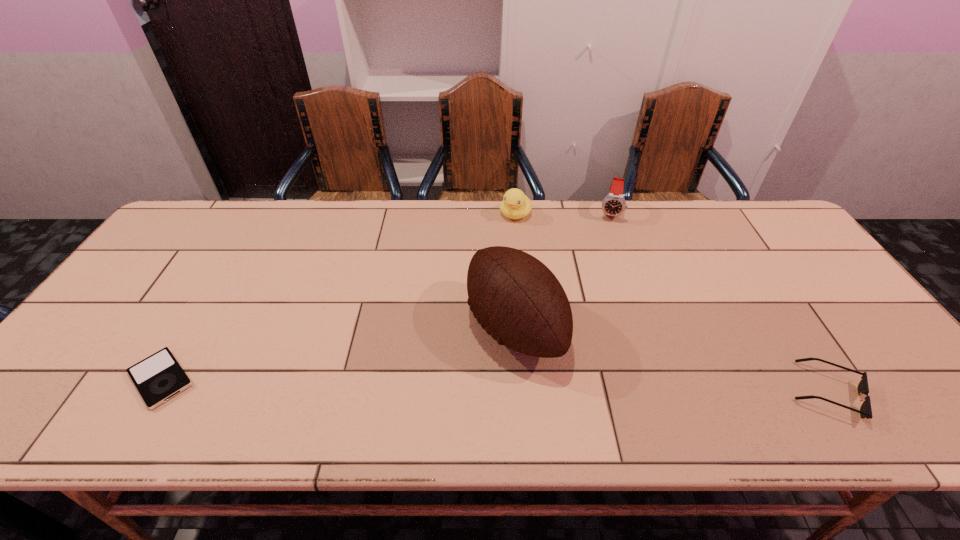
Image resolution: width=960 pixels, height=540 pixels. What are the coordinates of `vacant space positioned on the laces of the tallest object` in the screenshot? It's located at (400, 389).

Where is `vacant area situated 0.190m on the laces of the tallest object`? The width and height of the screenshot is (960, 540). vacant area situated 0.190m on the laces of the tallest object is located at coordinates (400, 389).

I want to click on free point located on the face of the second object from right to left, so click(x=603, y=275).

Locate an element on the screen. This screenshot has width=960, height=540. free spot located on the face of the second object from right to left is located at coordinates (608, 233).

Identify the location of free location located on the face of the second object from right to left. Image resolution: width=960 pixels, height=540 pixels. (599, 308).

I want to click on vacant space located at the beak of the duckling, so click(x=459, y=300).

At what (x,y) coordinates should I click in order to perform the action: click on free region located 0.360m at the beak of the duckling. Please return your answer as a coordinate pair (x, y). Looking at the image, I should click on (461, 298).

This screenshot has height=540, width=960. In order to click on free spot located at the beak of the duckling in this screenshot , I will do `click(464, 293)`.

Locate an element on the screen. This screenshot has height=540, width=960. watch at the far edge is located at coordinates (614, 204).

Identify the location of duckling that is at the far edge. (515, 205).